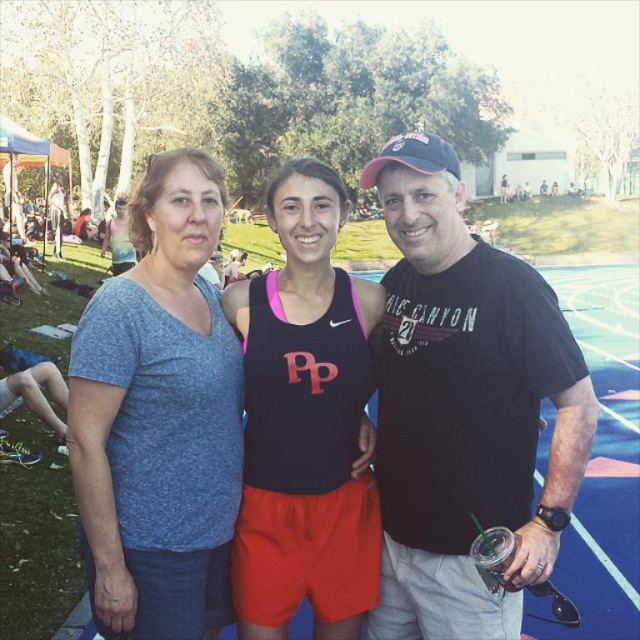
You are a photographer at the sports event and want to ensure that both the blue cotton shirt at center and the black matte tank top at center are visible in your photo. Given their height difference, which one might you need to adjust your camera angle to capture fully?

The blue cotton shirt at center is much taller than the black matte tank top at center, so you might need to lower your camera angle to ensure the taller individual is fully visible while still capturing the shorter one.

You are taking a photo from the center of the image. There are two points marked in the image, point (557,504) and point (246,516). Which point is closer to you?

Point (557,504) is in front of point (246,516), so it is closer to you.